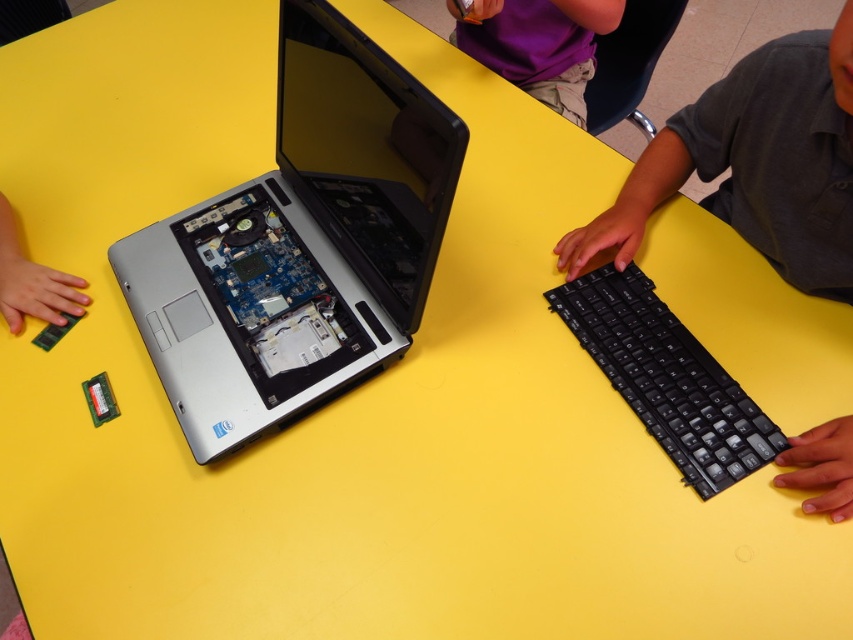
Which is more to the left, silver metallic laptop at center or purple fabric shirt at upper center?

Positioned to the left is silver metallic laptop at center.

What do you see at coordinates (294, 252) in the screenshot? I see `silver metallic laptop at center` at bounding box center [294, 252].

Locate an element on the screen. This screenshot has width=853, height=640. silver metallic laptop at center is located at coordinates (294, 252).

Who is taller, black matte keyboard at right or purple fabric shirt at upper center?

black matte keyboard at right

Measure the distance between black matte keyboard at right and purple fabric shirt at upper center.

They are 18.00 inches apart.

Which is in front, point (654, 138) or point (460, 42)?

Point (654, 138) is in front.

This screenshot has width=853, height=640. I want to click on black matte keyboard at right, so click(656, 179).

Does silver metallic laptop at center come in front of black plastic keyboard at right?

Yes, silver metallic laptop at center is in front of black plastic keyboard at right.

Is silver metallic laptop at center below black plastic keyboard at right?

No, silver metallic laptop at center is not below black plastic keyboard at right.

The image size is (853, 640). What do you see at coordinates (294, 252) in the screenshot?
I see `silver metallic laptop at center` at bounding box center [294, 252].

Where is `silver metallic laptop at center`? Image resolution: width=853 pixels, height=640 pixels. silver metallic laptop at center is located at coordinates (294, 252).